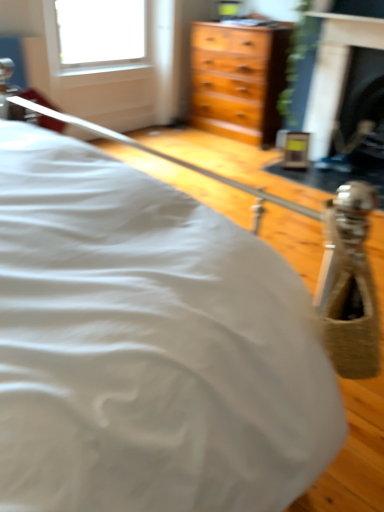
Question: Considering the relative positions of black marble fireplace at upper right, which appears as the first fireplace when viewed from the left, and black glass fireplace at upper right, the 1th fireplace positioned from the right, in the image provided, is black marble fireplace at upper right, which appears as the first fireplace when viewed from the left, to the left or to the right of black glass fireplace at upper right, the 1th fireplace positioned from the right,?

Choices:
 (A) left
 (B) right

Answer: (A)

Question: Is black marble fireplace at upper right, which appears as the first fireplace when viewed from the left, in front of or behind black glass fireplace at upper right, which is the second fireplace from left to right, in the image?

Choices:
 (A) front
 (B) behind

Answer: (A)

Question: From the image's perspective, is black marble fireplace at upper right, which appears as the first fireplace when viewed from the left, positioned above or below black glass fireplace at upper right, which is the second fireplace from left to right?

Choices:
 (A) above
 (B) below

Answer: (A)

Question: Considering the positions of black glass fireplace at upper right, the 1th fireplace positioned from the right, and black marble fireplace at upper right, which appears as the first fireplace when viewed from the left, in the image, is black glass fireplace at upper right, the 1th fireplace positioned from the right, wider or thinner than black marble fireplace at upper right, which appears as the first fireplace when viewed from the left,?

Choices:
 (A) thin
 (B) wide

Answer: (B)

Question: Based on their sizes in the image, would you say black glass fireplace at upper right, the 1th fireplace positioned from the right, is bigger or smaller than black marble fireplace at upper right, which appears as the first fireplace when viewed from the left?

Choices:
 (A) big
 (B) small

Answer: (A)

Question: From the image's perspective, is black glass fireplace at upper right, which is the second fireplace from left to right, located above or below black marble fireplace at upper right, which appears as the first fireplace when viewed from the left?

Choices:
 (A) above
 (B) below

Answer: (B)

Question: Is black glass fireplace at upper right, which is the second fireplace from left to right, situated inside black marble fireplace at upper right, the second fireplace positioned from the right, or outside?

Choices:
 (A) inside
 (B) outside

Answer: (B)